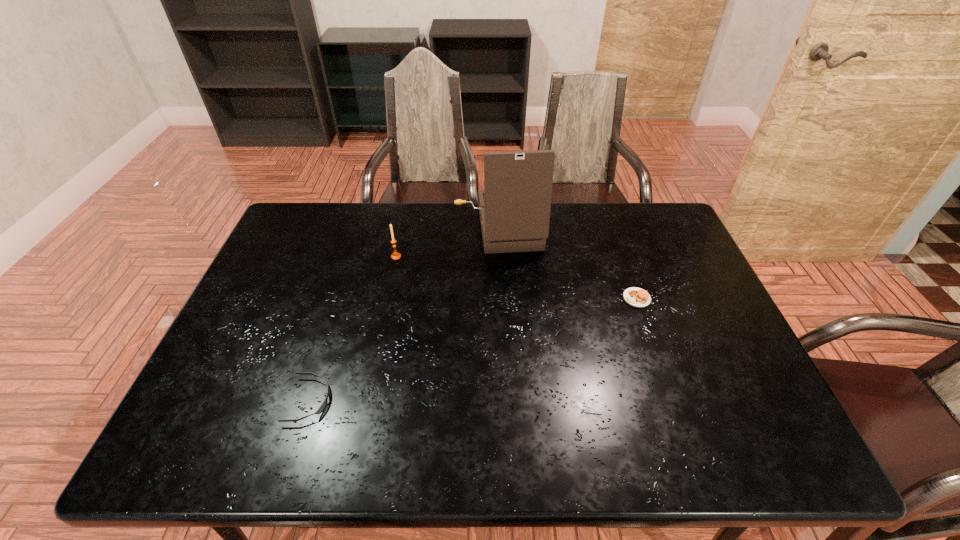
Where is `vacant space in between the nearest object and the second object from left to right`? Image resolution: width=960 pixels, height=540 pixels. vacant space in between the nearest object and the second object from left to right is located at coordinates (352, 328).

Find the location of a particular element. The image size is (960, 540). free space between the third shortest object and the phonograph record is located at coordinates (447, 242).

Identify the location of unoccupied area between the sunglasses and the candle_holder. The width and height of the screenshot is (960, 540). (352, 328).

You are a GUI agent. You are given a task and a screenshot of the screen. Output one action in this format:
    pyautogui.click(x=<x>, y=<y>)
    Task: Click on the vacant point located between the tallest object and the nearest object
    
    Given the screenshot: What is the action you would take?
    pyautogui.click(x=403, y=314)

The width and height of the screenshot is (960, 540). In order to click on free space between the phonograph record and the second nearest object in this screenshot , I will do `click(567, 263)`.

Where is `blank region between the second shortest object and the leftmost object`? The image size is (960, 540). blank region between the second shortest object and the leftmost object is located at coordinates (473, 349).

Find the location of a particular element. vacant area between the patty and the third shortest object is located at coordinates (516, 278).

This screenshot has height=540, width=960. What are the coordinates of `free space between the leftmost object and the second object from left to right` in the screenshot? It's located at (352, 328).

Image resolution: width=960 pixels, height=540 pixels. In order to click on free spot between the candle_holder and the shortest object in this screenshot , I will do `click(352, 328)`.

What are the coordinates of `free point between the phonograph record and the sunglasses` in the screenshot? It's located at (403, 314).